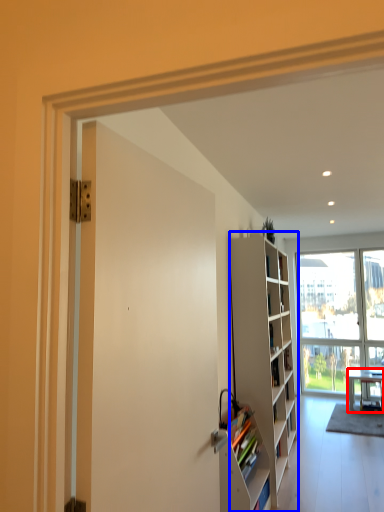
Question: Among these objects, which one is nearest to the camera, desk (highlighted by a red box) or cabinetry (highlighted by a blue box)?

Choices:
 (A) desk
 (B) cabinetry

Answer: (B)